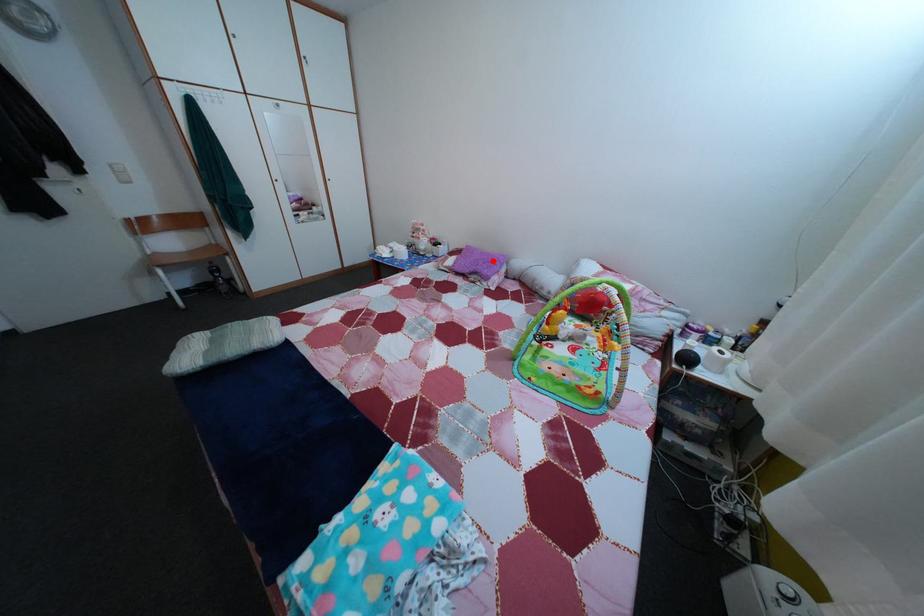
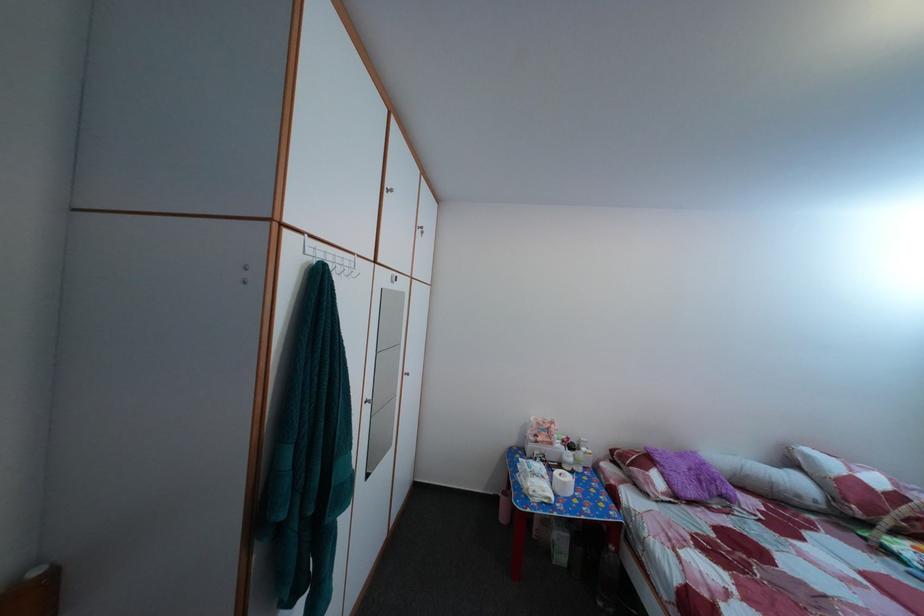
Question: I am providing you with two images of the same scene from different viewpoints. A red point is marked on the first image. At the location where the point appears in image 1, is it still visible in image 2?

Choices:
 (A) Yes
 (B) No

Answer: (A)